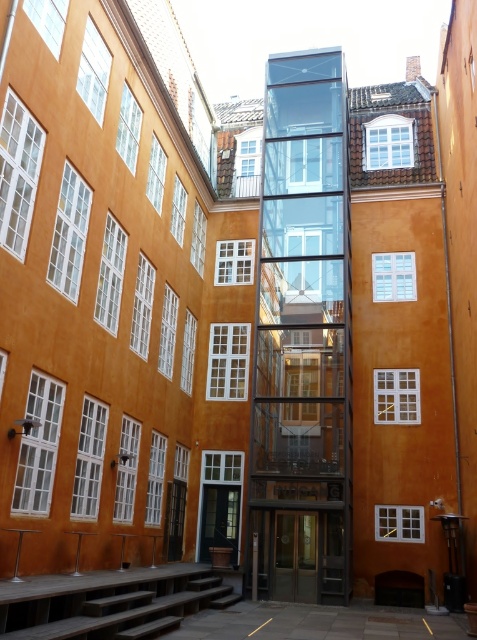
Question: Which point is farther to the camera?

Choices:
 (A) (231, 547)
 (B) (99, 608)

Answer: (A)

Question: Does metallic glass door at center have a greater width compared to wooden door at center?

Choices:
 (A) yes
 (B) no

Answer: (A)

Question: Is dark brown wooden stairs at lower left thinner than wooden door at center?

Choices:
 (A) no
 (B) yes

Answer: (A)

Question: Can you confirm if transparent glass elevator at center is thinner than wooden door at center?

Choices:
 (A) yes
 (B) no

Answer: (B)

Question: Which point is closer to the camera?

Choices:
 (A) dark brown wooden stairs at lower left
 (B) transparent glass elevator at center
 (C) metallic glass door at center
 (D) wooden door at center

Answer: (A)

Question: Which point is farther to the camera?

Choices:
 (A) coord(330,429)
 (B) coord(221,522)
 (C) coord(280,552)

Answer: (B)